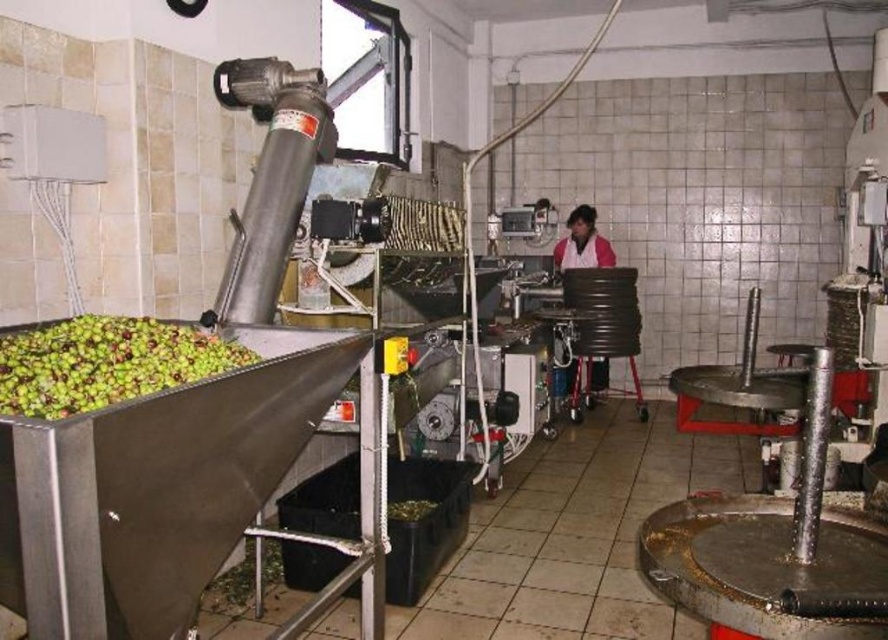
Question: Is green matte olives at left in front of pink fabric at center?

Choices:
 (A) yes
 (B) no

Answer: (A)

Question: Is green matte olives at left to the right of pink fabric at center from the viewer's perspective?

Choices:
 (A) no
 (B) yes

Answer: (A)

Question: Does green matte olives at left lie in front of pink fabric at center?

Choices:
 (A) no
 (B) yes

Answer: (B)

Question: Which point appears farthest from the camera in this image?

Choices:
 (A) (561, 257)
 (B) (115, 340)

Answer: (A)